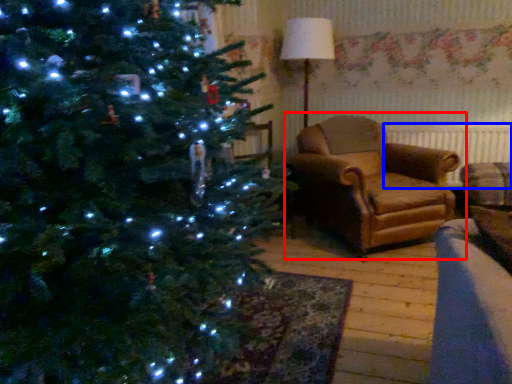
Question: Which point is further to the camera, studio couch (highlighted by a red box) or radiator (highlighted by a blue box)?

Choices:
 (A) studio couch
 (B) radiator

Answer: (B)